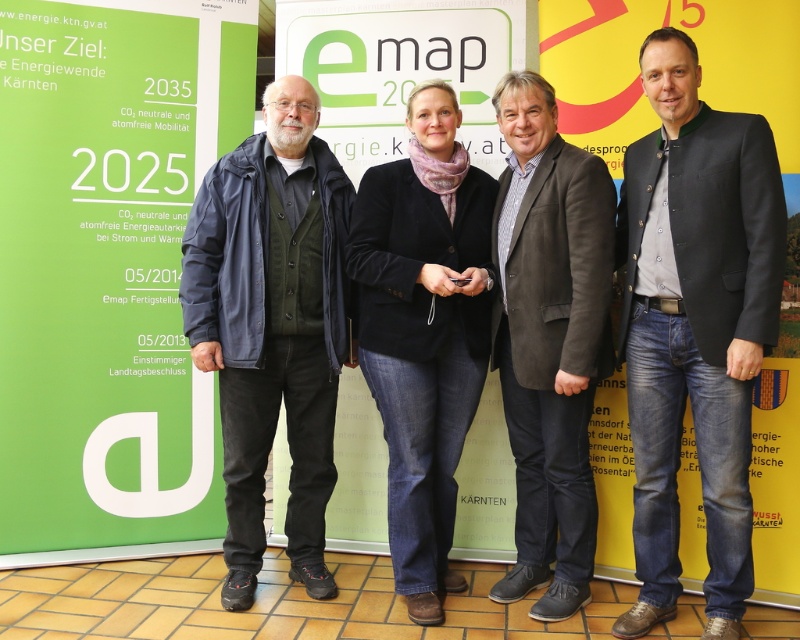
Question: Is dark blue jacket at left closer to the viewer compared to brown suede jacket at center?

Choices:
 (A) no
 (B) yes

Answer: (A)

Question: Estimate the real-world distances between objects in this image. Which object is farther from the dark blue jacket at left?

Choices:
 (A) green paperboard sign at left
 (B) green matte sign at center
 (C) dark gray suit at center
 (D) brown suede jacket at center

Answer: (C)

Question: Can you confirm if dark gray suit at center is thinner than dark blue jacket at left?

Choices:
 (A) no
 (B) yes

Answer: (B)

Question: Among these objects, which one is nearest to the camera?

Choices:
 (A) green paperboard sign at left
 (B) dark blue jacket at left
 (C) velvet black blazer at center
 (D) brown suede jacket at center

Answer: (D)

Question: Can you confirm if dark gray suit at center is positioned above velvet black blazer at center?

Choices:
 (A) no
 (B) yes

Answer: (B)

Question: Among these objects, which one is nearest to the camera?

Choices:
 (A) green paperboard sign at left
 (B) brown suede jacket at center

Answer: (B)